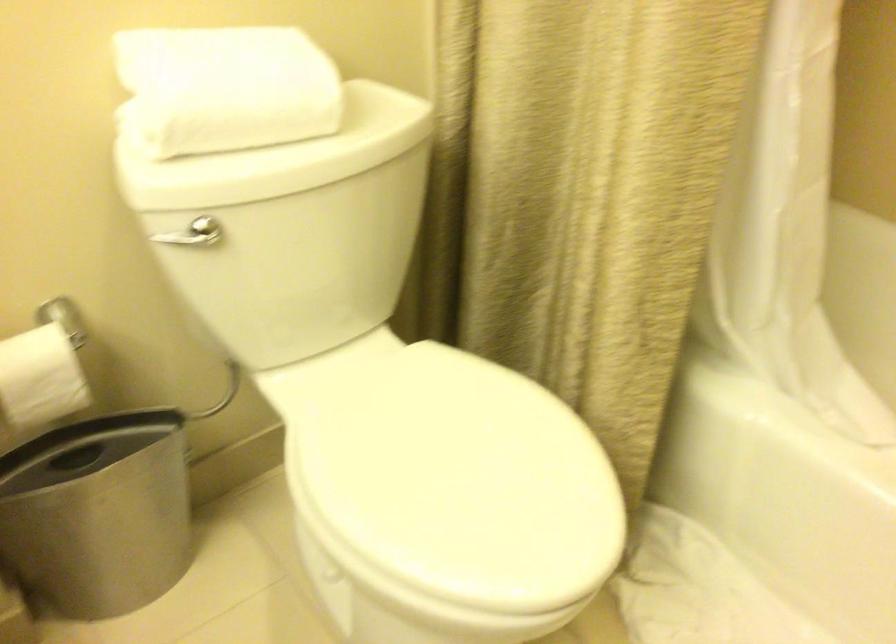
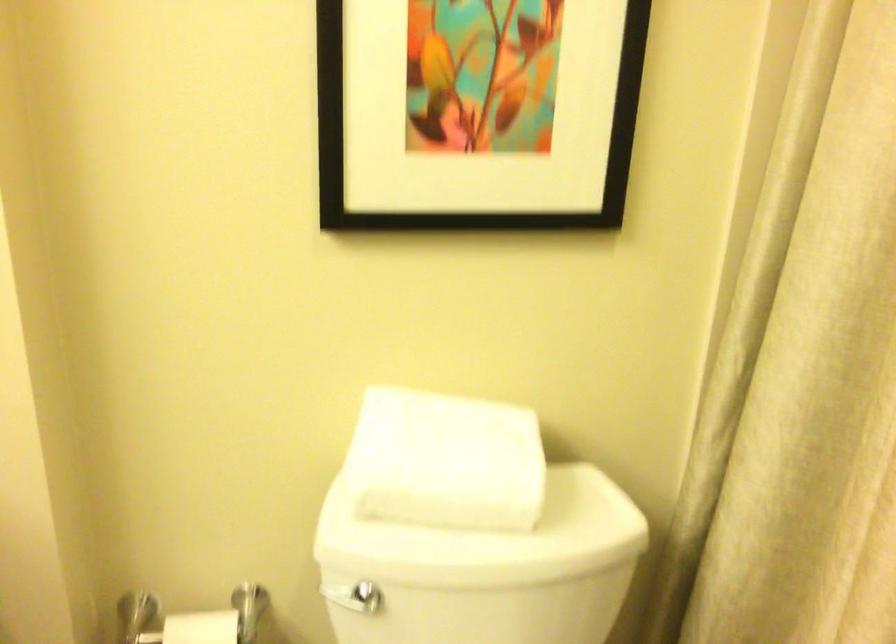
The point at (237, 75) is marked in the first image. Where is the corresponding point in the second image?

(445, 460)